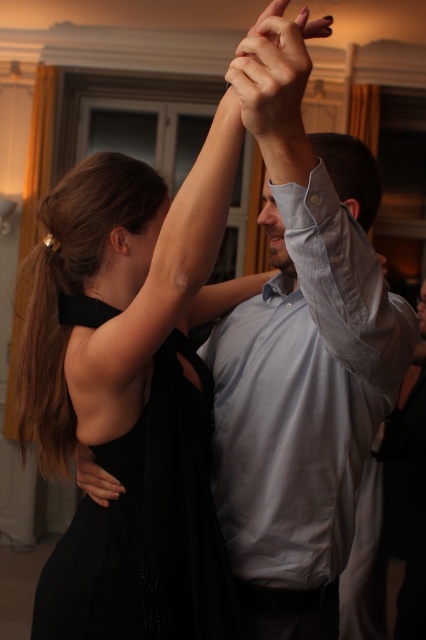
Question: Which object appears farthest from the camera in this image?

Choices:
 (A) matte skin at upper center
 (B) black satin dress at center
 (C) black satin dress at lower left

Answer: (C)

Question: Can you confirm if matte skin at upper center is positioned above black satin dress at lower left?

Choices:
 (A) yes
 (B) no

Answer: (A)

Question: Which point is farther from the camera taking this photo?

Choices:
 (A) (178, 362)
 (B) (264, 138)
 (C) (86, 449)

Answer: (C)

Question: Which object is closer to the camera taking this photo?

Choices:
 (A) black satin dress at center
 (B) matte skin at upper center

Answer: (B)

Question: Does matte skin at upper center appear on the left side of black satin dress at lower left?

Choices:
 (A) yes
 (B) no

Answer: (B)

Question: Does black satin dress at center appear on the right side of matte skin at upper center?

Choices:
 (A) yes
 (B) no

Answer: (B)